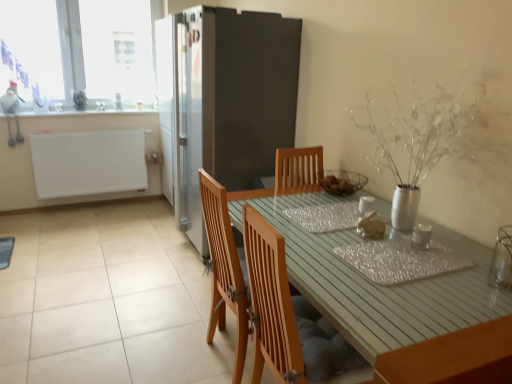
Question: Based on their sizes in the image, would you say transparent glass window at upper left is bigger or smaller than wooden table at center?

Choices:
 (A) big
 (B) small

Answer: (B)

Question: Relative to wooden table at center, is transparent glass window at upper left in front or behind?

Choices:
 (A) front
 (B) behind

Answer: (B)

Question: Which object is the closest to the white matte radiator at left?

Choices:
 (A) shiny metallic placemat at center
 (B) matte gold bunny at center
 (C) wooden chair at lower center, which is the first chair from front to back
 (D) white glossy counter top at upper left
 (E) transparent glass window at upper left

Answer: (D)

Question: Which of these objects is positioned farthest from the white glossy counter top at upper left?

Choices:
 (A) white matte radiator at left
 (B) wooden chair at center, acting as the first chair starting from the back
 (C) transparent plastic window screen at upper left
 (D) wooden table at center
 (E) wooden chair at lower center, the 2th chair in the back-to-front sequence

Answer: (D)